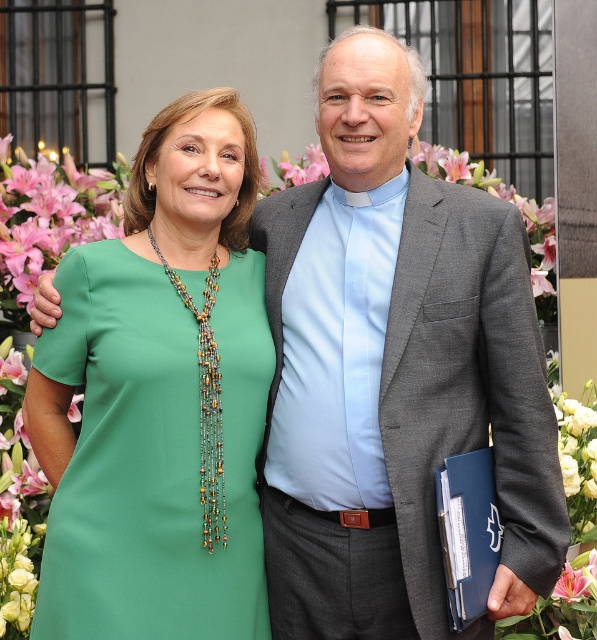
You are a photographer taking a picture of the green fabric dress at center and the blue leather folder at right. Which object will appear closer to the camera in the photo?

The green fabric dress at center will appear closer to the camera in the photo because it is positioned in front of the blue leather folder at right.

You are a photographer trying to capture a clear shot of both the green fabric dress at center and the blue leather folder at right. However, the folder is partially hidden. Which object is blocking the view of the folder?

The green fabric dress at center is positioned over the blue leather folder at right, so it is blocking the view of the folder.

From the picture: You are a photographer trying to capture a clear shot of both the green fabric dress at center and the blue leather folder at right. Based on their sizes, which object should you focus on first to ensure it appears sharp in the photo?

The green fabric dress at center is much taller than the blue leather folder at right, so you should focus on the green fabric dress at center first to ensure its sharpness, as larger objects require more precise focusing.